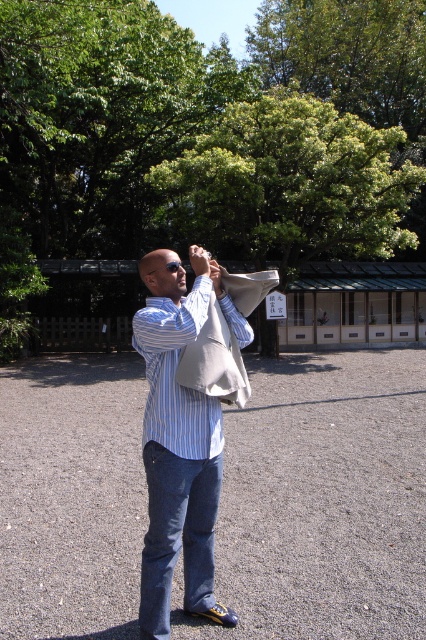
Question: Can you confirm if denim at center is thinner than blue striped shirt at center?

Choices:
 (A) no
 (B) yes

Answer: (A)

Question: Which object is positioned farthest from the blue striped shirt at center?

Choices:
 (A) matte blue shirt at center
 (B) denim at center

Answer: (B)

Question: Observing the image, what is the correct spatial positioning of denim at center in reference to blue striped shirt at center?

Choices:
 (A) below
 (B) above

Answer: (A)

Question: Which point is farther to the camera?

Choices:
 (A) denim at center
 (B) blue striped shirt at center

Answer: (A)

Question: Is denim at center above blue striped shirt at center?

Choices:
 (A) yes
 (B) no

Answer: (B)

Question: Which of the following is the farthest from the observer?

Choices:
 (A) (175, 365)
 (B) (152, 320)
 (C) (187, 506)

Answer: (C)